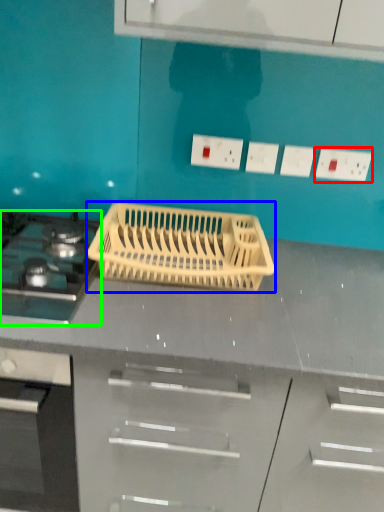
Question: Based on their relative distances, which object is farther from electric outlet (highlighted by a red box)? Choose from kitchen appliance (highlighted by a blue box) and gas stove (highlighted by a green box).

Choices:
 (A) kitchen appliance
 (B) gas stove

Answer: (B)